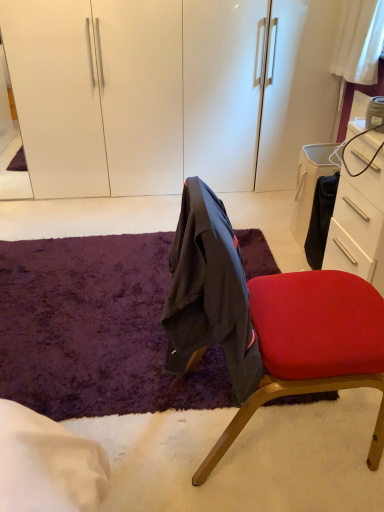
Locate an element on the screen. purple shaggy rug at center is located at coordinates (95, 329).

Identify the location of purple shaggy rug at center. (95, 329).

Looking at this image, does purple shaggy rug at center have a larger size compared to velvet red chair at center?

Incorrect, purple shaggy rug at center is not larger than velvet red chair at center.

Is velvet red chair at center at the back of purple shaggy rug at center?

No, velvet red chair at center is not at the back of purple shaggy rug at center.

Based on the photo, is purple shaggy rug at center next to velvet red chair at center?

purple shaggy rug at center and velvet red chair at center are not in contact.

Can you confirm if purple shaggy rug at center is wider than white glossy drawer at right?

Correct, the width of purple shaggy rug at center exceeds that of white glossy drawer at right.

What's the angular difference between purple shaggy rug at center and white glossy drawer at right's facing directions?

The angle between the facing direction of purple shaggy rug at center and the facing direction of white glossy drawer at right is 89.7 degrees.

Can you confirm if purple shaggy rug at center is shorter than white glossy drawer at right?

Yes.

Is purple shaggy rug at center looking in the opposite direction of white glossy drawer at right?

purple shaggy rug at center does not have its back to white glossy drawer at right.

Is velvet red chair at center turned away from white glossy drawer at right?

No, velvet red chair at center is not facing the opposite direction of white glossy drawer at right.

Is velvet red chair at center further to the viewer compared to white glossy drawer at right?

That is False.

Between velvet red chair at center and white glossy drawer at right, which one has larger width?

Wider between the two is velvet red chair at center.

Can you tell me how much velvet red chair at center and white glossy drawer at right differ in facing direction?

velvet red chair at center and white glossy drawer at right are facing 178 degrees away from each other.

Where is `mat directly beneath the white glossy drawer at right (from a real-world perspective)`? This screenshot has width=384, height=512. mat directly beneath the white glossy drawer at right (from a real-world perspective) is located at coordinates (95, 329).

Which is more to the left, white glossy drawer at right or purple shaggy rug at center?

From the viewer's perspective, purple shaggy rug at center appears more on the left side.

Is white glossy drawer at right next to purple shaggy rug at center?

No, white glossy drawer at right is not making contact with purple shaggy rug at center.

Between velvet red chair at center and purple shaggy rug at center, which one has larger width?

With larger width is purple shaggy rug at center.

Is velvet red chair at center not inside purple shaggy rug at center?

Yes, velvet red chair at center is outside of purple shaggy rug at center.

Is velvet red chair at center placed right next to purple shaggy rug at center?

velvet red chair at center and purple shaggy rug at center are not in contact.

Is velvet red chair at center smaller than purple shaggy rug at center?

No, velvet red chair at center is not smaller than purple shaggy rug at center.

Is white glossy drawer at right to the left or to the right of velvet red chair at center in the image?

white glossy drawer at right is positioned on velvet red chair at center's right side.

Consider the image. Is white glossy drawer at right shorter than velvet red chair at center?

Yes.

Considering the positions of point (354, 161) and point (382, 298), is point (354, 161) closer or farther from the camera than point (382, 298)?

Clearly, point (354, 161) is more distant from the camera than point (382, 298).

From a real-world perspective, is white glossy drawer at right above or below velvet red chair at center?

In terms of real-world spatial position, white glossy drawer at right is below velvet red chair at center.

You are a GUI agent. You are given a task and a screenshot of the screen. Output one action in this format:
    pyautogui.click(x=<x>, y=<y>)
    Task: Click on the mat below the velvet red chair at center (from a real-world perspective)
    
    Given the screenshot: What is the action you would take?
    pos(95,329)

Identify the location of desk that is on the right side of purple shaggy rug at center. (359, 225).

Based on their spatial positions, is white glossy drawer at right or purple shaggy rug at center further from velvet red chair at center?

Among the two, purple shaggy rug at center is located further to velvet red chair at center.

Looking at this image, when comparing their distances from white glossy drawer at right, does velvet red chair at center or purple shaggy rug at center seem further?

Based on the image, purple shaggy rug at center appears to be further to white glossy drawer at right.

Considering their positions, is white glossy drawer at right positioned further to purple shaggy rug at center than velvet red chair at center?

The object further to purple shaggy rug at center is white glossy drawer at right.

Estimate the real-world distances between objects in this image. Which object is closer to white glossy drawer at right, purple shaggy rug at center or velvet red chair at center?

Based on the image, velvet red chair at center appears to be nearer to white glossy drawer at right.

Which object lies nearer to the anchor point velvet red chair at center, purple shaggy rug at center or white glossy drawer at right?

Among the two, white glossy drawer at right is located nearer to velvet red chair at center.

Which object lies further to the anchor point purple shaggy rug at center, velvet red chair at center or white glossy drawer at right?

Among the two, white glossy drawer at right is located further to purple shaggy rug at center.

Find the location of a particular element. chair between purple shaggy rug at center and white glossy drawer at right in the horizontal direction is located at coordinates (312, 346).